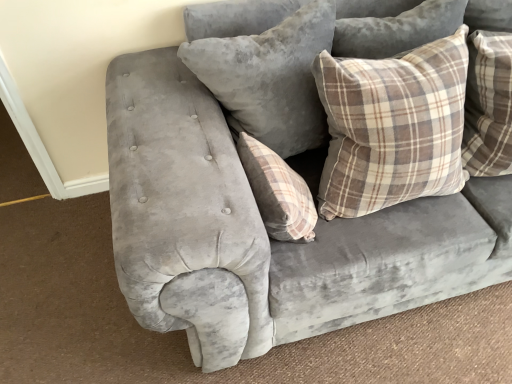
In order to click on brown plaid pillow at upper right, which is the third pillow in left-to-right order in this screenshot , I will do `click(392, 127)`.

Where is `plush gray pillow at upper center, which appears as the 3th pillow when viewed from the right`? This screenshot has height=384, width=512. plush gray pillow at upper center, which appears as the 3th pillow when viewed from the right is located at coordinates (268, 73).

I want to click on plaid fabric pillow at center, which is the 2th pillow from right to left, so click(x=278, y=192).

Consider the image. How far apart are plush gray pillow at upper center, the first pillow when ordered from left to right, and plaid fabric pillow at center, which is the 2th pillow from right to left?

plush gray pillow at upper center, the first pillow when ordered from left to right, is 10.23 inches from plaid fabric pillow at center, which is the 2th pillow from right to left.

Between point (317, 107) and point (267, 181), which one is positioned in front?

The point (267, 181) is more forward.

Which of these two, plush gray pillow at upper center, which appears as the 3th pillow when viewed from the right, or plaid fabric pillow at center, which is the 2th pillow from right to left, is smaller?

Smaller between the two is plaid fabric pillow at center, which is the 2th pillow from right to left.

Is plush gray pillow at upper center, the first pillow when ordered from left to right, turned away from plaid fabric pillow at center, which is the 2th pillow from right to left?

That's not correct — plush gray pillow at upper center, the first pillow when ordered from left to right, is not looking away from plaid fabric pillow at center, which is the 2th pillow from right to left.

Considering the sizes of objects brown plaid pillow at upper right, the first pillow in the right-to-left sequence, and plush gray pillow at upper center, the first pillow when ordered from left to right, in the image provided, who is taller, brown plaid pillow at upper right, the first pillow in the right-to-left sequence, or plush gray pillow at upper center, the first pillow when ordered from left to right,?

With more height is plush gray pillow at upper center, the first pillow when ordered from left to right.

How different are the orientations of brown plaid pillow at upper right, which is the third pillow in left-to-right order, and plush gray pillow at upper center, which appears as the 3th pillow when viewed from the right, in degrees?

The facing directions of brown plaid pillow at upper right, which is the third pillow in left-to-right order, and plush gray pillow at upper center, which appears as the 3th pillow when viewed from the right, are 6.76e-05 degrees apart.

From the image's perspective, relative to plush gray pillow at upper center, which appears as the 3th pillow when viewed from the right, is brown plaid pillow at upper right, which is the third pillow in left-to-right order, above or below?

brown plaid pillow at upper right, which is the third pillow in left-to-right order, is situated lower than plush gray pillow at upper center, which appears as the 3th pillow when viewed from the right, in the image.

Is point (450, 163) positioned before point (283, 136)?

Yes, point (450, 163) is closer to viewer.

Considering the positions of objects brown plaid pillow at upper right, which is the third pillow in left-to-right order, and plaid fabric pillow at center, which is the 2th pillow from right to left, in the image provided, who is more to the left, brown plaid pillow at upper right, which is the third pillow in left-to-right order, or plaid fabric pillow at center, which is the 2th pillow from right to left,?

Positioned to the left is plaid fabric pillow at center, which is the 2th pillow from right to left.

Which object is more forward, brown plaid pillow at upper right, the first pillow in the right-to-left sequence, or plaid fabric pillow at center, the second pillow positioned from the left?

Positioned in front is brown plaid pillow at upper right, the first pillow in the right-to-left sequence.

From a real-world perspective, is brown plaid pillow at upper right, the first pillow in the right-to-left sequence, physically above plaid fabric pillow at center, the second pillow positioned from the left?

Yes, from a real-world perspective, brown plaid pillow at upper right, the first pillow in the right-to-left sequence, is over plaid fabric pillow at center, the second pillow positioned from the left

Which object is positioned more to the left, plaid fabric pillow at center, which is the 2th pillow from right to left, or plush gray pillow at upper center, the first pillow when ordered from left to right?

Positioned to the left is plush gray pillow at upper center, the first pillow when ordered from left to right.

Which point is more distant from viewer, (300, 204) or (303, 100)?

The point (303, 100) is farther from the camera.

From the image's perspective, which one is positioned lower, plaid fabric pillow at center, the second pillow positioned from the left, or plush gray pillow at upper center, which appears as the 3th pillow when viewed from the right?

From the image's view, plaid fabric pillow at center, the second pillow positioned from the left, is below.

Can brown plaid pillow at upper right, which is the third pillow in left-to-right order, be found inside plush gray pillow at upper center, which appears as the 3th pillow when viewed from the right?

No, brown plaid pillow at upper right, which is the third pillow in left-to-right order, is not surrounded by plush gray pillow at upper center, which appears as the 3th pillow when viewed from the right.

Considering the relative sizes of plush gray pillow at upper center, which appears as the 3th pillow when viewed from the right, and brown plaid pillow at upper right, the first pillow in the right-to-left sequence, in the image provided, is plush gray pillow at upper center, which appears as the 3th pillow when viewed from the right, taller than brown plaid pillow at upper right, the first pillow in the right-to-left sequence,?

Yes.

Is plush gray pillow at upper center, the first pillow when ordered from left to right, smaller than brown plaid pillow at upper right, which is the third pillow in left-to-right order?

Actually, plush gray pillow at upper center, the first pillow when ordered from left to right, might be larger than brown plaid pillow at upper right, which is the third pillow in left-to-right order.

In terms of width, does plush gray pillow at upper center, which appears as the 3th pillow when viewed from the right, look wider or thinner when compared to brown plaid pillow at upper right, the first pillow in the right-to-left sequence?

plush gray pillow at upper center, which appears as the 3th pillow when viewed from the right, is wider than brown plaid pillow at upper right, the first pillow in the right-to-left sequence.

Is plaid fabric pillow at center, the second pillow positioned from the left, facing towards brown plaid pillow at upper right, which is the third pillow in left-to-right order?

Yes, plaid fabric pillow at center, the second pillow positioned from the left, is oriented towards brown plaid pillow at upper right, which is the third pillow in left-to-right order.

Does plaid fabric pillow at center, the second pillow positioned from the left, contain brown plaid pillow at upper right, which is the third pillow in left-to-right order?

No, brown plaid pillow at upper right, which is the third pillow in left-to-right order, is not inside plaid fabric pillow at center, the second pillow positioned from the left.

In the scene shown: Which object is positioned more to the right, plaid fabric pillow at center, the second pillow positioned from the left, or brown plaid pillow at upper right, the first pillow in the right-to-left sequence?

brown plaid pillow at upper right, the first pillow in the right-to-left sequence, is more to the right.

From a real-world perspective, who is located lower, plaid fabric pillow at center, the second pillow positioned from the left, or brown plaid pillow at upper right, which is the third pillow in left-to-right order?

plaid fabric pillow at center, the second pillow positioned from the left, from a real-world perspective.

Identify the location of pillow lying on the left of plaid fabric pillow at center, which is the 2th pillow from right to left. (268, 73).

Which pillow is the 2nd one when counting from the right side of the plush gray pillow at upper center, which appears as the 3th pillow when viewed from the right? Please provide its 2D coordinates.

[(392, 127)]

Based on their spatial positions, is plush gray pillow at upper center, the first pillow when ordered from left to right, or plaid fabric pillow at center, the second pillow positioned from the left, further from brown plaid pillow at upper right, which is the third pillow in left-to-right order?

Among the two, plaid fabric pillow at center, the second pillow positioned from the left, is located further to brown plaid pillow at upper right, which is the third pillow in left-to-right order.

From the picture: When comparing their distances from plaid fabric pillow at center, which is the 2th pillow from right to left, does brown plaid pillow at upper right, the first pillow in the right-to-left sequence, or plush gray pillow at upper center, the first pillow when ordered from left to right, seem further?

plush gray pillow at upper center, the first pillow when ordered from left to right, lies further to plaid fabric pillow at center, which is the 2th pillow from right to left, than the other object.

Considering their positions, is plaid fabric pillow at center, the second pillow positioned from the left, positioned further to plush gray pillow at upper center, the first pillow when ordered from left to right, than brown plaid pillow at upper right, the first pillow in the right-to-left sequence?

plaid fabric pillow at center, the second pillow positioned from the left, is positioned further to the anchor plush gray pillow at upper center, the first pillow when ordered from left to right.

From the image, which object appears to be farther from brown plaid pillow at upper right, the first pillow in the right-to-left sequence, plaid fabric pillow at center, the second pillow positioned from the left, or plush gray pillow at upper center, the first pillow when ordered from left to right?

plaid fabric pillow at center, the second pillow positioned from the left, lies further to brown plaid pillow at upper right, the first pillow in the right-to-left sequence, than the other object.

Based on their spatial positions, is brown plaid pillow at upper right, the first pillow in the right-to-left sequence, or plaid fabric pillow at center, which is the 2th pillow from right to left, further from plush gray pillow at upper center, which appears as the 3th pillow when viewed from the right?

plaid fabric pillow at center, which is the 2th pillow from right to left.

Based on their spatial positions, is plush gray pillow at upper center, the first pillow when ordered from left to right, or brown plaid pillow at upper right, which is the third pillow in left-to-right order, further from plaid fabric pillow at center, the second pillow positioned from the left?

Among the two, plush gray pillow at upper center, the first pillow when ordered from left to right, is located further to plaid fabric pillow at center, the second pillow positioned from the left.

Where is `pillow located between plush gray pillow at upper center, the first pillow when ordered from left to right, and brown plaid pillow at upper right, which is the third pillow in left-to-right order, in the left-right direction`? pillow located between plush gray pillow at upper center, the first pillow when ordered from left to right, and brown plaid pillow at upper right, which is the third pillow in left-to-right order, in the left-right direction is located at coordinates (278, 192).